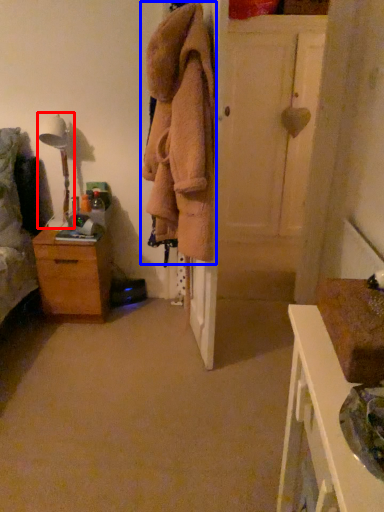
Question: Which object appears farthest to the camera in this image, table lamp (highlighted by a red box) or clothing (highlighted by a blue box)?

Choices:
 (A) table lamp
 (B) clothing

Answer: (A)